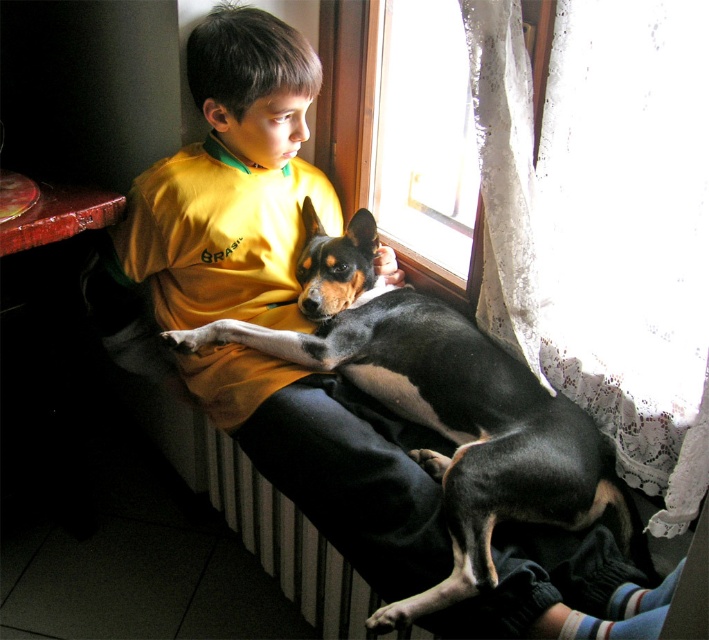
You are an interior designer planning to place a new decorative item in the room where the black smooth dog at center is located. The item must be placed exactly where the dog is currently positioned. What are the coordinates of the location where you should place the new item?

The coordinates for placing the new item should be at point (442, 408), as that is the 2D location of the black smooth dog at center.

From the picture: You are a photographer aiming to capture the black smooth dog at center and the transparent glass window at upper center in a single frame. Based on their positions, will the window appear above or below the dog in the photo?

The black smooth dog at center is positioned under the transparent glass window at upper center, so the window will appear above the dog in the photo.